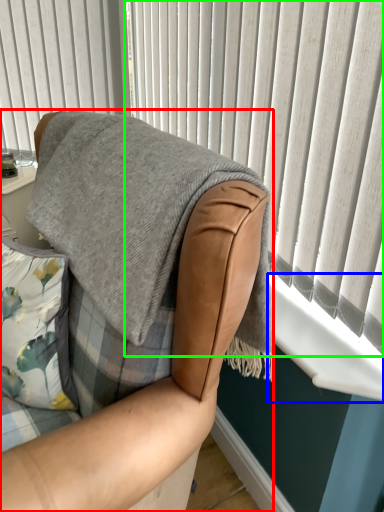
Question: Which object is positioned closest to chair (highlighted by a red box)? Select from window sill (highlighted by a blue box) and curtain (highlighted by a green box).

Choices:
 (A) window sill
 (B) curtain

Answer: (A)